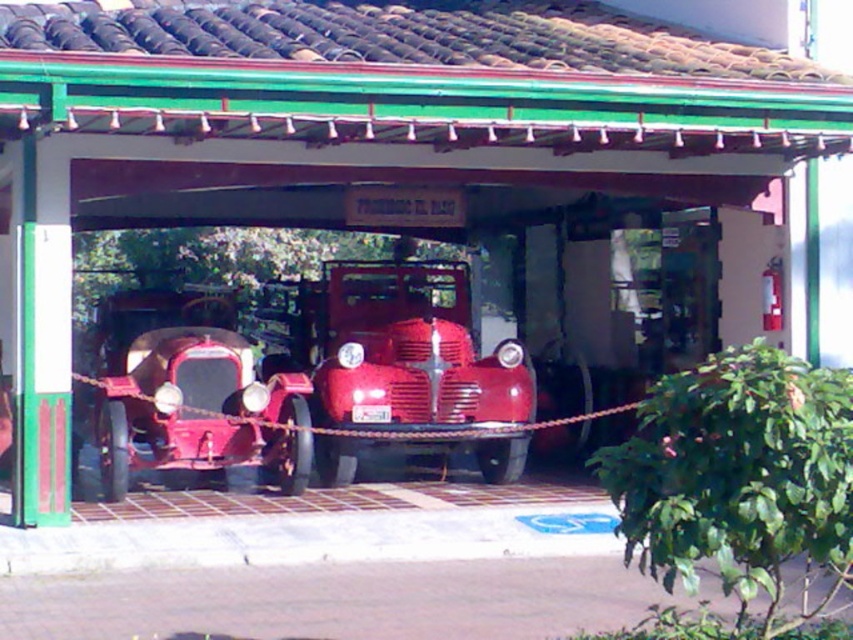
Is glossy red truck at center wider than shiny red car at center?

Indeed, glossy red truck at center has a greater width compared to shiny red car at center.

Find the location of a particular element. The height and width of the screenshot is (640, 853). glossy red truck at center is located at coordinates (393, 348).